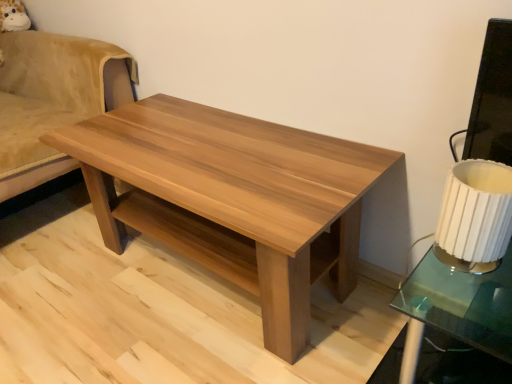
Question: Relative to white pleated fabric lampshade at right, is light brown wood swivel chair at left in front or behind?

Choices:
 (A) front
 (B) behind

Answer: (B)

Question: Considering the positions of light brown wood swivel chair at left and white pleated fabric lampshade at right in the image, is light brown wood swivel chair at left bigger or smaller than white pleated fabric lampshade at right?

Choices:
 (A) small
 (B) big

Answer: (B)

Question: Considering the real-world distances, which object is farthest from the white pleated fabric lampshade at right?

Choices:
 (A) natural wood coffee table at center
 (B) light brown wood swivel chair at left

Answer: (B)

Question: Which object is the farthest from the natural wood coffee table at center?

Choices:
 (A) light brown wood swivel chair at left
 (B) white pleated fabric lampshade at right

Answer: (A)